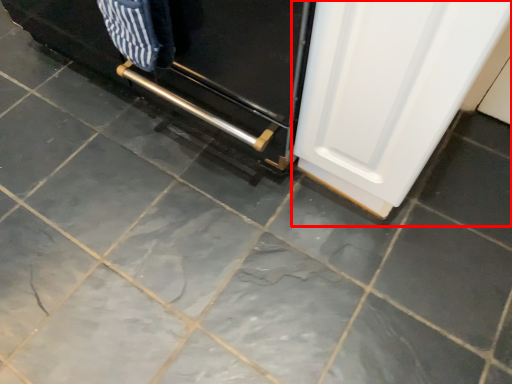
Question: Where is door (annotated by the red box) located in relation to oven in the image?

Choices:
 (A) right
 (B) left

Answer: (A)